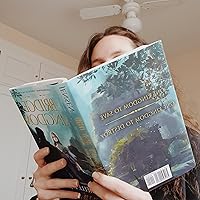
The image size is (200, 200). Identify the location of cabinets. (10, 138), (22, 73), (60, 73), (31, 168).